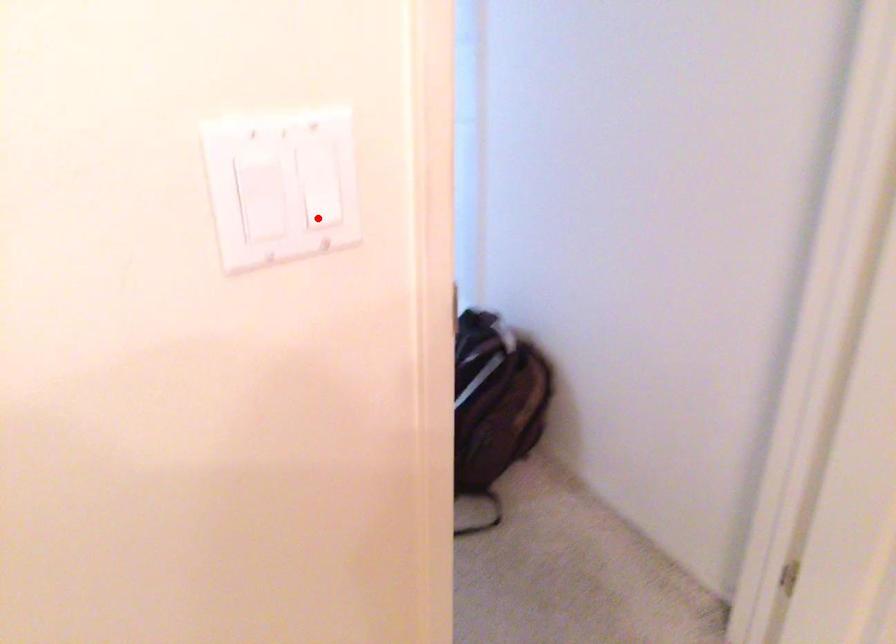
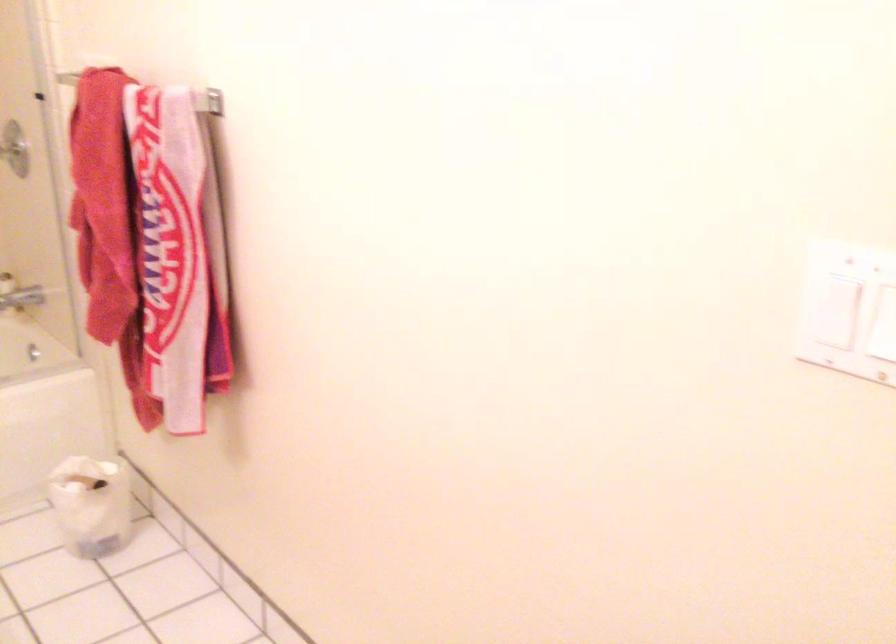
The point at the highlighted location is marked in the first image. Where is the corresponding point in the second image?

(883, 319)